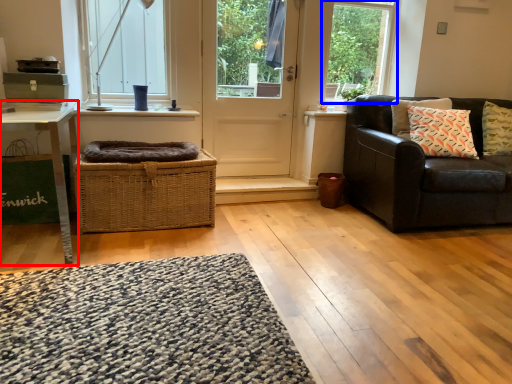
Question: Which object is further to the camera taking this photo, table (highlighted by a red box) or window frame (highlighted by a blue box)?

Choices:
 (A) table
 (B) window frame

Answer: (B)